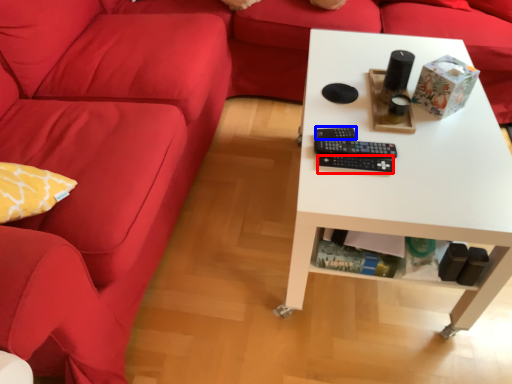
Question: Which object is further to the camera taking this photo, control (highlighted by a red box) or control (highlighted by a blue box)?

Choices:
 (A) control
 (B) control

Answer: (B)